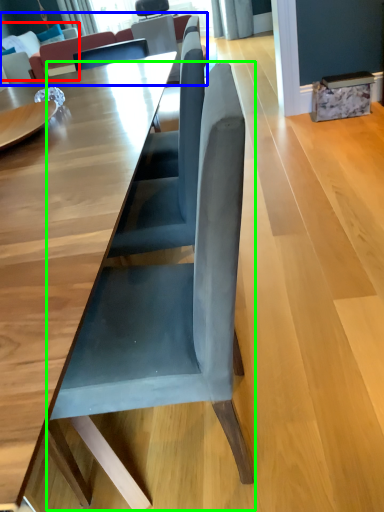
Question: Which object is the farthest from couch (highlighted by a red box)? Choose among these: couch (highlighted by a blue box) or chair (highlighted by a green box).

Choices:
 (A) couch
 (B) chair

Answer: (B)